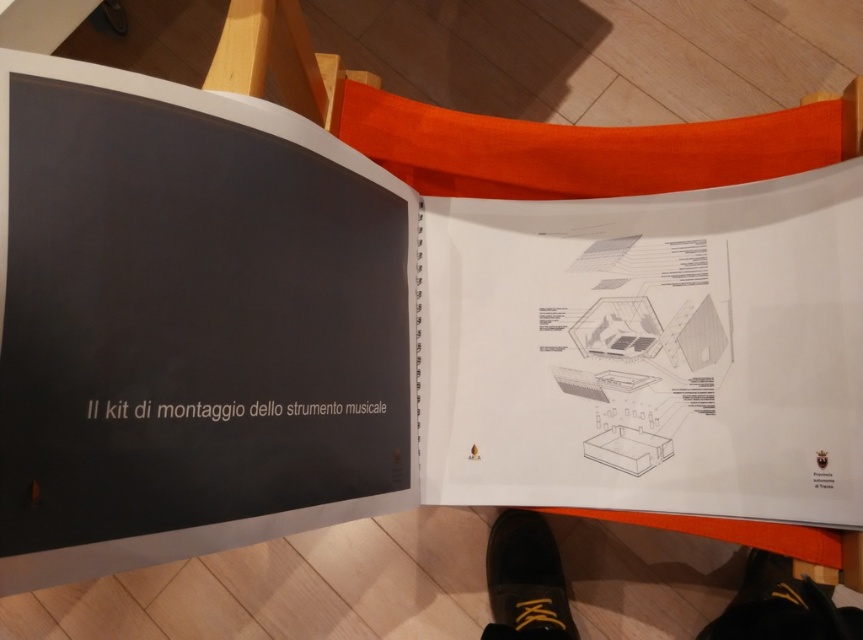
Question: Is black leather shoe at lower center thinner than black leather shoe at lower right?

Choices:
 (A) no
 (B) yes

Answer: (B)

Question: Can you confirm if black leather shoe at lower center is smaller than black leather shoe at lower right?

Choices:
 (A) yes
 (B) no

Answer: (A)

Question: Estimate the real-world distances between objects in this image. Which object is closer to the black leather shoes at lower center?

Choices:
 (A) black leather shoe at lower center
 (B) black leather shoe at lower right

Answer: (B)

Question: Which object appears farthest from the camera in this image?

Choices:
 (A) black leather shoes at lower center
 (B) black leather shoe at lower center

Answer: (B)

Question: Is black leather shoes at lower center wider than black leather shoe at lower right?

Choices:
 (A) no
 (B) yes

Answer: (B)

Question: Considering the real-world distances, which object is farthest from the black leather shoes at lower center?

Choices:
 (A) black leather shoe at lower center
 (B) black leather shoe at lower right

Answer: (A)